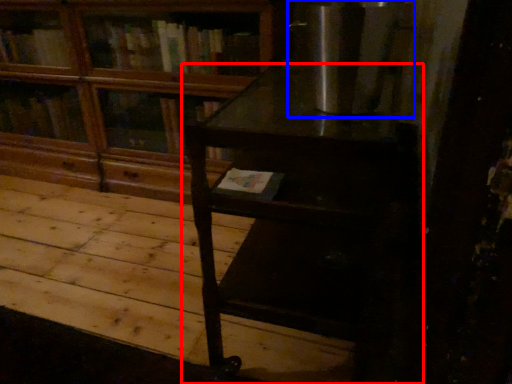
Question: Which of the following is the closest to the observer, table (highlighted by a red box) or appliance (highlighted by a blue box)?

Choices:
 (A) table
 (B) appliance

Answer: (A)